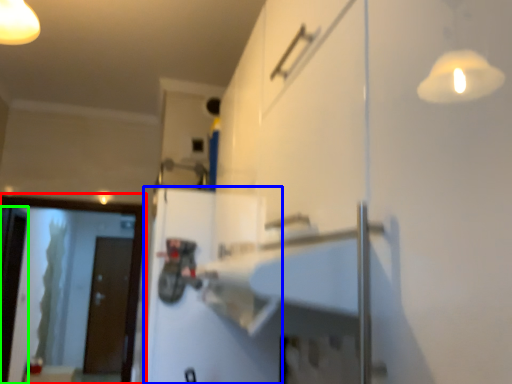
Question: Estimate the real-world distances between objects in this image. Which object is closer to screen door (highlighted by a red box), door (highlighted by a blue box) or screen door (highlighted by a green box)?

Choices:
 (A) door
 (B) screen door

Answer: (B)